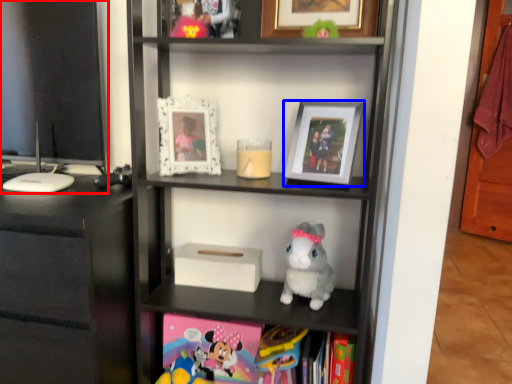
Question: Which of the following is the closest to the observer, computer monitor (highlighted by a red box) or picture frame (highlighted by a blue box)?

Choices:
 (A) computer monitor
 (B) picture frame

Answer: (B)